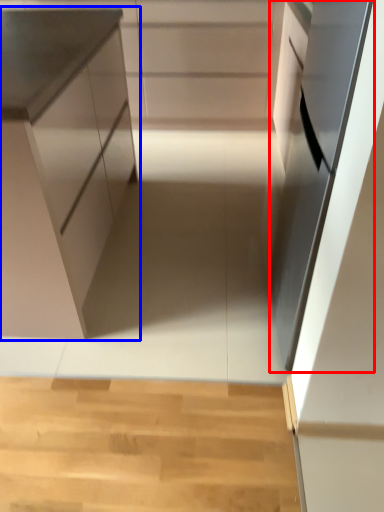
Question: Which point is further to the camera, oven (highlighted by a red box) or cabinetry (highlighted by a blue box)?

Choices:
 (A) oven
 (B) cabinetry

Answer: (B)